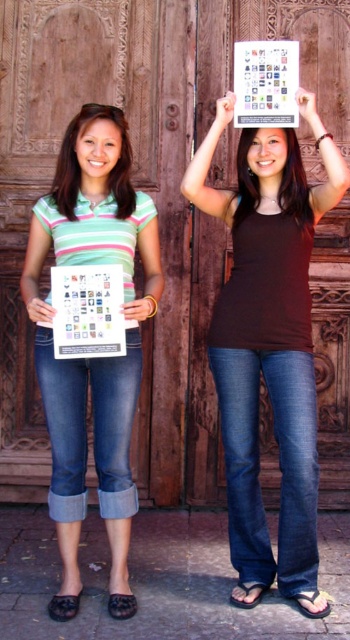
Question: Is white paper calendar at center behind white paper calendar at upper center?

Choices:
 (A) yes
 (B) no

Answer: (B)

Question: Which point appears farthest from the camera in this image?

Choices:
 (A) (283, 204)
 (B) (59, 148)
 (C) (255, 232)

Answer: (B)

Question: Which point is farther to the camera?

Choices:
 (A) white paper calendar at center
 (B) brown matte tank top at upper center
 (C) matte green striped shirt at center

Answer: (B)

Question: Does matte green striped shirt at center appear over white paper calendar at upper center?

Choices:
 (A) yes
 (B) no

Answer: (B)

Question: Is matte green striped shirt at center closer to camera compared to white paper calendar at upper center?

Choices:
 (A) no
 (B) yes

Answer: (B)

Question: Based on their relative distances, which object is nearer to the matte green striped shirt at center?

Choices:
 (A) matte brown shirt at upper center
 (B) white paper calendar at center
 (C) white paper calendar at upper center

Answer: (B)